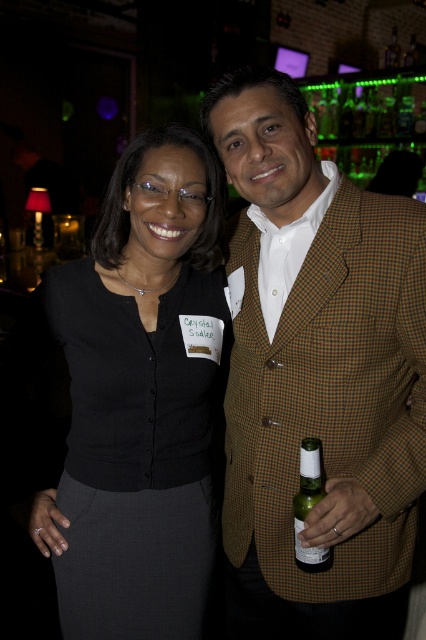
Question: Which point is farther to the camera?

Choices:
 (A) black fabric skirt at center
 (B) brown checkered blazer at center

Answer: (A)

Question: Does brown checkered blazer at center appear on the right side of black fabric skirt at center?

Choices:
 (A) yes
 (B) no

Answer: (A)

Question: Which object is closer to the camera taking this photo?

Choices:
 (A) brown checkered blazer at center
 (B) green glass bottle at center

Answer: (B)

Question: Among these points, which one is nearest to the camera?

Choices:
 (A) (131, 248)
 (B) (308, 554)

Answer: (B)

Question: Is black fabric skirt at center thinner than green glass bottle at center?

Choices:
 (A) no
 (B) yes

Answer: (A)

Question: Observing the image, what is the correct spatial positioning of brown checkered blazer at center in reference to green glass bottle at center?

Choices:
 (A) above
 (B) below

Answer: (A)